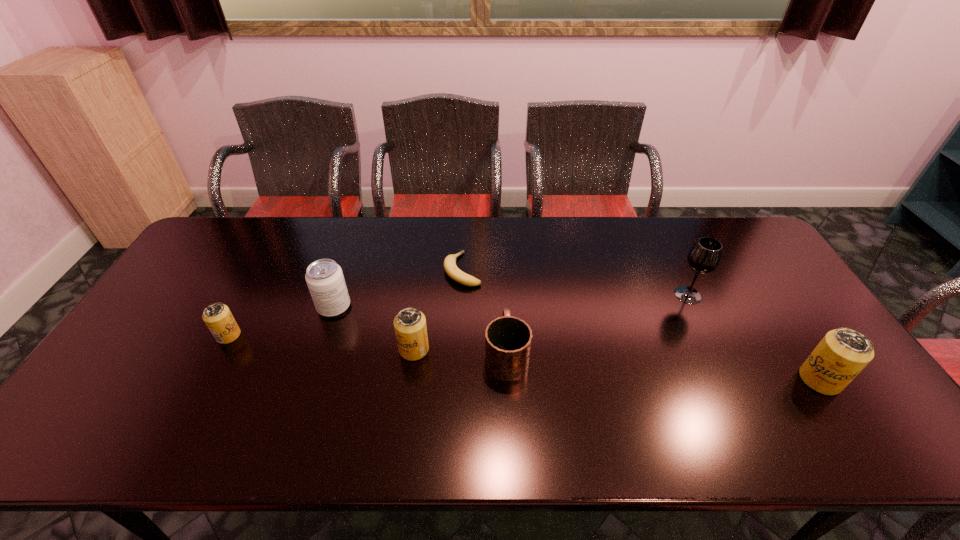
Please point a space for a new beer_can to maintain equal intervals. Please provide its 2D coordinates. Your answer should be formatted as a tuple, i.e. [(x, y)], where the tuple contains the x and y coordinates of a point satisfying the conditions above.

[(611, 364)]